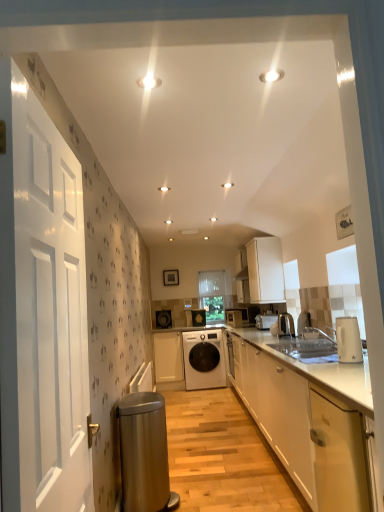
Identify the location of stainless steel water heater at lower left. This screenshot has height=512, width=384. click(144, 453).

What do you see at coordinates (303, 428) in the screenshot? The height and width of the screenshot is (512, 384). I see `white glossy cabinet at lower right, arranged as the 2th cabinetry when viewed from the right` at bounding box center [303, 428].

This screenshot has height=512, width=384. What do you see at coordinates (286, 325) in the screenshot?
I see `satin silver kettle at right, placed as the first appliance when sorted from front to back` at bounding box center [286, 325].

This screenshot has height=512, width=384. I want to click on satin silver kettle at right, placed as the first appliance when sorted from front to back, so click(286, 325).

You are a GUI agent. You are given a task and a screenshot of the screen. Output one action in this format:
    pyautogui.click(x=<x>, y=<y>)
    Task: Click on the white glossy toaster at center, the 3th appliance from the front
    The width and height of the screenshot is (384, 512).
    Given the screenshot: What is the action you would take?
    pyautogui.click(x=265, y=320)

Measure the distance between transparent plastic window screen at center and camera.

transparent plastic window screen at center and camera are 6.03 meters apart from each other.

At what (x,y) coordinates should I click in order to perform the action: click on white glossy cabinet at lower right, which is counted as the first cabinetry, starting from the front. Please return your answer as a coordinate pair (x, y). Looking at the image, I should click on (338, 456).

Is transparent plastic window screen at center looking in the opposite direction of white matte washing machine at center?

No, white matte washing machine at center is not at the back of transparent plastic window screen at center.

From their relative heights in the image, would you say transparent plastic window screen at center is taller or shorter than white matte washing machine at center?

Considering their sizes, transparent plastic window screen at center has more height than white matte washing machine at center.

Is transparent plastic window screen at center in front of or behind white matte washing machine at center in the image?

transparent plastic window screen at center is positioned farther from the viewer than white matte washing machine at center.

From a real-world perspective, who is located lower, transparent plastic window screen at center or white matte washing machine at center?

From a 3D spatial view, white matte washing machine at center is below.

From a real-world perspective, is white glossy toaster at center, acting as the 3th appliance starting from the back, on white glossy electric kettle at right?

No.

Is there a large distance between white glossy toaster at center, acting as the 3th appliance starting from the back, and white glossy electric kettle at right?

Yes, white glossy toaster at center, acting as the 3th appliance starting from the back, and white glossy electric kettle at right are located far from each other.

Is white glossy toaster at center, acting as the 3th appliance starting from the back, at the left side of white glossy electric kettle at right?

Yes.

Image resolution: width=384 pixels, height=512 pixels. I want to click on kitchen appliance in front of the white glossy toaster at center, placed as the 4th appliance when sorted from front to back, so click(x=348, y=340).

Is white glossy cabinet at lower right, arranged as the third cabinetry when viewed from the back, bigger than white glossy cabinet at lower right, which is counted as the first cabinetry, starting from the front?

Correct, white glossy cabinet at lower right, arranged as the third cabinetry when viewed from the back, is larger in size than white glossy cabinet at lower right, which is counted as the first cabinetry, starting from the front.

Would you say white glossy cabinet at lower right, arranged as the 2th cabinetry when viewed from the right, is to the left or to the right of white glossy cabinet at lower right, the third cabinetry from the right, in the picture?

From the image, it's evident that white glossy cabinet at lower right, arranged as the 2th cabinetry when viewed from the right, is to the right of white glossy cabinet at lower right, the third cabinetry from the right.

At what (x,y) coordinates should I click in order to perform the action: click on cabinetry in front of the white glossy cabinet at lower right, acting as the 2th cabinetry starting from the front. Please return your answer as a coordinate pair (x, y). The width and height of the screenshot is (384, 512). Looking at the image, I should click on (338, 456).

Could you tell me if white glossy cabinet at lower right, the 3th cabinetry positioned from the left, is turned towards white glossy cabinet at lower right, the 2th cabinetry in the left-to-right sequence?

No, white glossy cabinet at lower right, the 3th cabinetry positioned from the left, is not turned towards white glossy cabinet at lower right, the 2th cabinetry in the left-to-right sequence.

In the scene shown: Could metallic silver microwave at center, the 1th appliance viewed from the back, be considered to be inside white glossy toaster at center, the 3th appliance from the front?

No, metallic silver microwave at center, the 1th appliance viewed from the back, is not a part of white glossy toaster at center, the 3th appliance from the front.

From the image's perspective, who appears lower, white glossy toaster at center, the fourth appliance viewed from the back, or metallic silver microwave at center, the sixth appliance when ordered from front to back?

metallic silver microwave at center, the sixth appliance when ordered from front to back, appears lower in the image.

Are white glossy toaster at center, the fourth appliance viewed from the back, and metallic silver microwave at center, the 1th appliance viewed from the back, making contact?

No, white glossy toaster at center, the fourth appliance viewed from the back, is not touching metallic silver microwave at center, the 1th appliance viewed from the back.

Between white glossy toaster at center, the 3th appliance from the front, and metallic silver microwave at center, the sixth appliance when ordered from front to back, which one is positioned behind?

metallic silver microwave at center, the sixth appliance when ordered from front to back.

Between white glossy door at left and stainless steel water heater at lower left, which one has less height?

With less height is stainless steel water heater at lower left.

Which object is more forward, white glossy door at left or stainless steel water heater at lower left?

white glossy door at left is in front.

The height and width of the screenshot is (512, 384). I want to click on water heater below the white glossy door at left (from the image's perspective), so click(x=144, y=453).

How distant is white glossy door at left from stainless steel water heater at lower left?

A distance of 1.40 meters exists between white glossy door at left and stainless steel water heater at lower left.

Can you confirm if white glossy toaster at center, placed as the 4th appliance when sorted from front to back, is taller than stainless steel water heater at lower left?

Incorrect, the height of white glossy toaster at center, placed as the 4th appliance when sorted from front to back, is not larger of that of stainless steel water heater at lower left.

Where is `water heater that appears in front of the white glossy toaster at center, placed as the 4th appliance when sorted from front to back`? water heater that appears in front of the white glossy toaster at center, placed as the 4th appliance when sorted from front to back is located at coordinates (144, 453).

Which object is more forward, white glossy toaster at center, placed as the 4th appliance when sorted from front to back, or stainless steel water heater at lower left?

stainless steel water heater at lower left.

Based on the photo, would you say white matte cabinet at upper center, the second cabinetry in the back-to-front sequence, is inside or outside white glossy toaster at center, the fourth appliance viewed from the back?

The correct answer is: outside.

The width and height of the screenshot is (384, 512). I want to click on cabinetry located above the white glossy toaster at center, the 3th appliance from the front (from the image's perspective), so click(x=264, y=270).

Looking at this image, considering the relative sizes of white matte cabinet at upper center, positioned as the 3th cabinetry in front-to-back order, and white glossy toaster at center, the fourth appliance viewed from the back, in the image provided, is white matte cabinet at upper center, positioned as the 3th cabinetry in front-to-back order, thinner than white glossy toaster at center, the fourth appliance viewed from the back,?

In fact, white matte cabinet at upper center, positioned as the 3th cabinetry in front-to-back order, might be wider than white glossy toaster at center, the fourth appliance viewed from the back.

Can you tell me how much white matte cabinet at upper center, which is the fourth cabinetry in left-to-right order, and white glossy toaster at center, the fourth appliance viewed from the back, differ in facing direction?

The angle between the facing direction of white matte cabinet at upper center, which is the fourth cabinetry in left-to-right order, and the facing direction of white glossy toaster at center, the fourth appliance viewed from the back, is 1.47 degrees.

Locate an element on the screen. This screenshot has width=384, height=512. home appliance that is in front of the transparent plastic window screen at center is located at coordinates (204, 359).

At what (x,y) coordinates should I click in order to perform the action: click on kitchen appliance above the white glossy toaster at center, acting as the 3th appliance starting from the back (from a real-world perspective). Please return your answer as a coordinate pair (x, y). This screenshot has height=512, width=384. Looking at the image, I should click on (348, 340).

Considering their positions, is matte black washing machine at center, the 5th appliance positioned from the front, positioned further to metallic silver kettle at right, which is the 2th appliance from front to back, than white glossy cabinet at lower right, the 2th cabinetry in the left-to-right sequence?

white glossy cabinet at lower right, the 2th cabinetry in the left-to-right sequence, is further to metallic silver kettle at right, which is the 2th appliance from front to back.

From the image, which object appears to be nearer to satin silver kettle at right, placed as the first appliance when sorted from front to back, white glossy door at left or white glossy electric kettle at right?

white glossy electric kettle at right.

Looking at the image, which one is located further to white matte cabinet at center, which appears as the first cabinetry when viewed from the back, metallic silver microwave at center, the 1th appliance viewed from the back, or white glossy toaster at center, placed as the 4th appliance when sorted from front to back?

metallic silver microwave at center, the 1th appliance viewed from the back.

Based on their spatial positions, is white glossy cabinet at lower right, arranged as the third cabinetry when viewed from the back, or satin silver kettle at right, which is the sixth appliance from back to front, closer to metallic silver microwave at center, the 1th appliance viewed from the back?

satin silver kettle at right, which is the sixth appliance from back to front, lies closer to metallic silver microwave at center, the 1th appliance viewed from the back, than the other object.

Based on their spatial positions, is white glossy toaster at center, the 3th appliance from the front, or white glossy door at left closer to white matte cabinet at upper center, positioned as the 3th cabinetry in front-to-back order?

white glossy toaster at center, the 3th appliance from the front, is positioned closer to the anchor white matte cabinet at upper center, positioned as the 3th cabinetry in front-to-back order.

In the scene shown: When comparing their distances from metallic silver microwave at center, the 1th appliance viewed from the back, does matte black washing machine at center, the 2th appliance from the back, or white matte washing machine at center seem closer?

white matte washing machine at center is closer to metallic silver microwave at center, the 1th appliance viewed from the back.

Looking at the image, which one is located closer to stainless steel water heater at lower left, white glossy cabinet at lower right, marked as the fourth cabinetry in a back-to-front arrangement, or satin silver kettle at right, which is the sixth appliance from back to front?

Among the two, white glossy cabinet at lower right, marked as the fourth cabinetry in a back-to-front arrangement, is located nearer to stainless steel water heater at lower left.

Looking at the image, which one is located closer to white matte cabinet at center, which is the fourth cabinetry in right-to-left order, white glossy toaster at center, placed as the 4th appliance when sorted from front to back, or white glossy cabinet at lower right, which is counted as the first cabinetry, starting from the front?

white glossy toaster at center, placed as the 4th appliance when sorted from front to back.

At what (x,y) coordinates should I click in order to perform the action: click on cabinetry situated between stainless steel water heater at lower left and white glossy electric kettle at right from left to right. Please return your answer as a coordinate pair (x, y). This screenshot has width=384, height=512. Looking at the image, I should click on (338, 456).

I want to click on kitchen appliance positioned between white glossy cabinet at lower right, which is counted as the first cabinetry, starting from the front, and white glossy toaster at center, the fourth appliance viewed from the back, from near to far, so click(x=348, y=340).

This screenshot has height=512, width=384. In order to click on appliance between white matte cabinet at upper center, which is the fourth cabinetry in left-to-right order, and white matte washing machine at center in the front-back direction in this screenshot , I will do `click(265, 320)`.

Identify the location of cabinetry located between white glossy cabinet at lower right, arranged as the third cabinetry when viewed from the back, and white matte cabinet at center, which ranks as the 1th cabinetry in left-to-right order, in the depth direction. (264, 270).